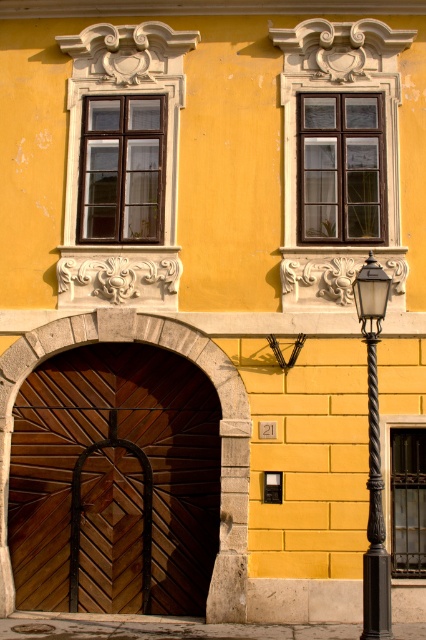
You are an architect designing a new building inspired by this European style. You need to ensure that the wooden at center and the matte black lamp post at right maintain their proportional relationship from the original image. Which object should have a greater width in your design?

The wooden at center should have a greater width than the matte black lamp post at right, as it is specified that the wooden at center is wider in the original image.

You are standing in front of the building and want to touch either the wooden at center or the matte black lamp post at right. Which object can you reach first as you move forward?

The wooden at center is closer to you than the matte black lamp post at right, so you can reach it first.

You are standing in front of the building and want to determine which of the two points, point [204,541] or point [377,586], is closer to you. Based on the image, which point is nearer?

Point [204,541] is closer to you because it is further to the viewer than point [377,586].